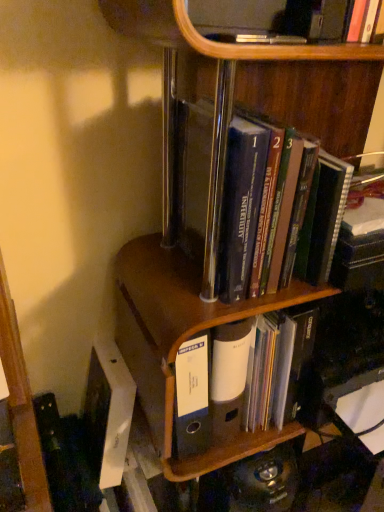
Question: Does brown wood file at center lie in front of white matte file folder at center, the first book positioned from the bottom?

Choices:
 (A) yes
 (B) no

Answer: (A)

Question: Can you confirm if brown wood file at center is bigger than white matte file folder at center, the second book positioned from the top?

Choices:
 (A) yes
 (B) no

Answer: (A)

Question: Does brown wood file at center appear on the left side of white matte file folder at center, the second book positioned from the top?

Choices:
 (A) yes
 (B) no

Answer: (A)

Question: Is brown wood file at center further to camera compared to white matte file folder at center, the first book positioned from the bottom?

Choices:
 (A) yes
 (B) no

Answer: (B)

Question: Could you tell me if brown wood file at center is turned towards white matte file folder at center, the first book positioned from the bottom?

Choices:
 (A) no
 (B) yes

Answer: (A)

Question: From a real-world perspective, is brown wood file at center located beneath white matte file folder at center, the first book positioned from the bottom?

Choices:
 (A) no
 (B) yes

Answer: (A)

Question: Is white matte file folder at center, the first book positioned from the bottom, beside hardcover books at center, which appears as the second book when ordered from the bottom?

Choices:
 (A) no
 (B) yes

Answer: (A)

Question: Is white matte file folder at center, the second book positioned from the top, taller than hardcover books at center, which appears as the second book when ordered from the bottom?

Choices:
 (A) yes
 (B) no

Answer: (B)

Question: Is white matte file folder at center, the second book positioned from the top, positioned far away from hardcover books at center, the first book in the top-to-bottom sequence?

Choices:
 (A) yes
 (B) no

Answer: (B)

Question: Can you confirm if white matte file folder at center, the first book positioned from the bottom, is wider than hardcover books at center, the first book in the top-to-bottom sequence?

Choices:
 (A) yes
 (B) no

Answer: (B)

Question: Considering the relative positions of white matte file folder at center, the first book positioned from the bottom, and hardcover books at center, which appears as the second book when ordered from the bottom, in the image provided, is white matte file folder at center, the first book positioned from the bottom, to the right of hardcover books at center, which appears as the second book when ordered from the bottom, from the viewer's perspective?

Choices:
 (A) no
 (B) yes

Answer: (B)

Question: Does white matte file folder at center, the first book positioned from the bottom, lie behind hardcover books at center, the first book in the top-to-bottom sequence?

Choices:
 (A) yes
 (B) no

Answer: (A)

Question: Considering the relative positions of white matte file folder at center, the first book positioned from the bottom, and brown wood file at center in the image provided, is white matte file folder at center, the first book positioned from the bottom, to the left of brown wood file at center from the viewer's perspective?

Choices:
 (A) yes
 (B) no

Answer: (B)